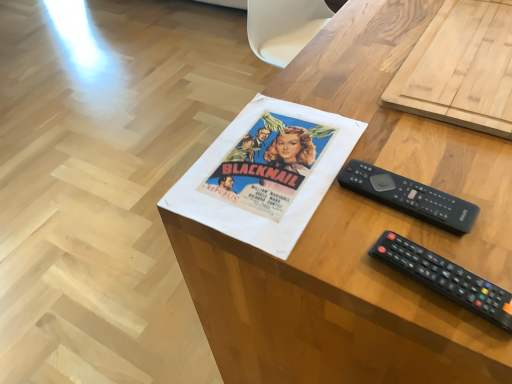
Question: Considering the relative positions of black plastic remote at center right, the first remote control positioned from the top, and black plastic remote at lower right, positioned as the first remote control in bottom-to-top order, in the image provided, is black plastic remote at center right, the first remote control positioned from the top, to the left of black plastic remote at lower right, positioned as the first remote control in bottom-to-top order, from the viewer's perspective?

Choices:
 (A) no
 (B) yes

Answer: (B)

Question: Is black plastic remote at center right, the 1th remote control when ordered from back to front, aimed at black plastic remote at lower right, positioned as the first remote control in bottom-to-top order?

Choices:
 (A) yes
 (B) no

Answer: (A)

Question: From the image's perspective, is black plastic remote at center right, the second remote control in the front-to-back sequence, over black plastic remote at lower right, which is the second remote control in top-to-bottom order?

Choices:
 (A) yes
 (B) no

Answer: (A)

Question: Is black plastic remote at center right, the first remote control positioned from the top, facing away from black plastic remote at lower right, the second remote control in the back-to-front sequence?

Choices:
 (A) no
 (B) yes

Answer: (A)

Question: From the image's perspective, would you say black plastic remote at center right, the first remote control positioned from the top, is shown under black plastic remote at lower right, positioned as the first remote control in bottom-to-top order?

Choices:
 (A) no
 (B) yes

Answer: (A)

Question: Considering the positions of black plastic remote at lower right, the second remote control in the back-to-front sequence, and woodendesk at center in the image, is black plastic remote at lower right, the second remote control in the back-to-front sequence, taller or shorter than woodendesk at center?

Choices:
 (A) tall
 (B) short

Answer: (B)

Question: Is black plastic remote at lower right, positioned as the first remote control in bottom-to-top order, inside the boundaries of woodendesk at center, or outside?

Choices:
 (A) outside
 (B) inside

Answer: (B)

Question: Is black plastic remote at lower right, positioned as the first remote control in bottom-to-top order, wider or thinner than woodendesk at center?

Choices:
 (A) thin
 (B) wide

Answer: (A)

Question: Considering the positions of point pos(412,273) and point pos(332,334), is point pos(412,273) closer or farther from the camera than point pos(332,334)?

Choices:
 (A) farther
 (B) closer

Answer: (B)

Question: Does point (392, 187) appear closer or farther from the camera than point (377, 269)?

Choices:
 (A) closer
 (B) farther

Answer: (B)

Question: Which is correct: black plastic remote at center right, the second remote control from the bottom, is inside woodendesk at center, or outside of it?

Choices:
 (A) inside
 (B) outside

Answer: (A)

Question: From a real-world perspective, relative to woodendesk at center, is black plastic remote at center right, the 1th remote control when ordered from back to front, vertically above or below?

Choices:
 (A) above
 (B) below

Answer: (A)

Question: Visually, is black plastic remote at center right, the first remote control positioned from the top, positioned to the left or to the right of woodendesk at center?

Choices:
 (A) left
 (B) right

Answer: (A)

Question: Is woodendesk at center taller or shorter than black plastic remote at lower right, which is the second remote control in top-to-bottom order?

Choices:
 (A) tall
 (B) short

Answer: (A)

Question: In terms of width, does woodendesk at center look wider or thinner when compared to black plastic remote at lower right, which is the second remote control in top-to-bottom order?

Choices:
 (A) thin
 (B) wide

Answer: (B)